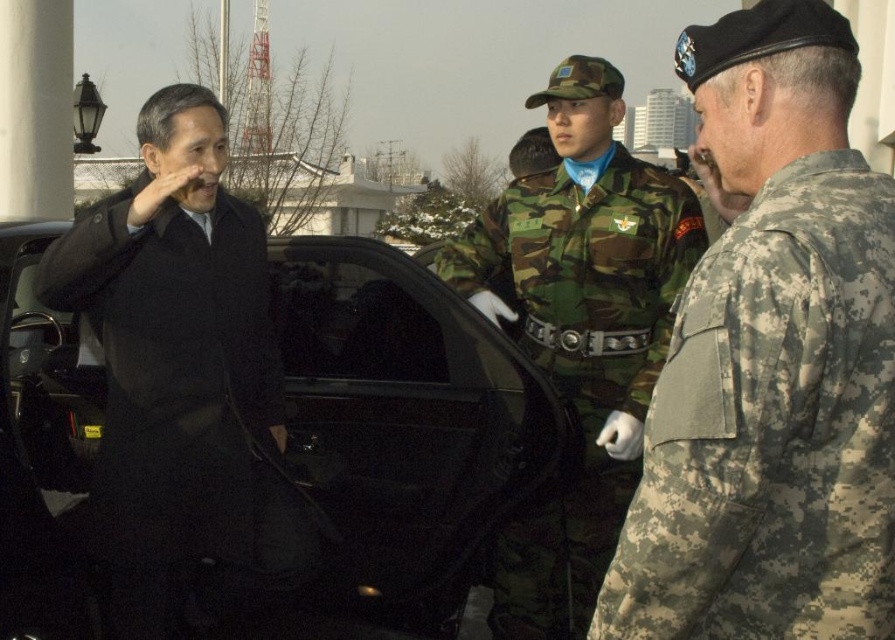
Question: Which of these objects is positioned closest to the camouflage fabric uniform at right?

Choices:
 (A) black matte car at center
 (B) camo fabric uniform at center

Answer: (B)

Question: In this image, where is camouflage fabric uniform at right located relative to black matte car at center?

Choices:
 (A) right
 (B) left

Answer: (A)

Question: Where is black matte car at center located in relation to black wool coat at left in the image?

Choices:
 (A) left
 (B) right

Answer: (B)

Question: Which of the following is the farthest from the observer?

Choices:
 (A) camo fabric uniform at center
 (B) camouflage fabric uniform at right
 (C) black wool coat at left

Answer: (A)

Question: Can you confirm if camouflage fabric uniform at right is positioned above black wool coat at left?

Choices:
 (A) yes
 (B) no

Answer: (A)

Question: Estimate the real-world distances between objects in this image. Which object is closer to the camo fabric uniform at center?

Choices:
 (A) camouflage fabric uniform at right
 (B) black matte car at center
 (C) black wool coat at left

Answer: (B)